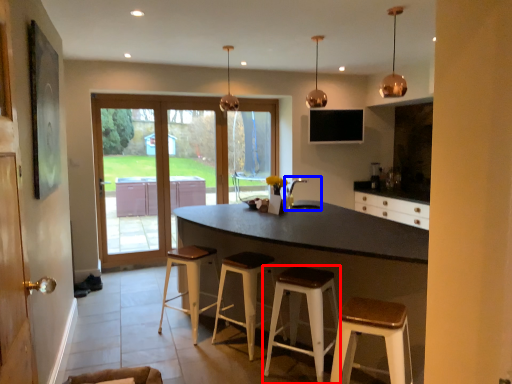
Question: Among these objects, which one is nearest to the camera, stool (highlighted by a red box) or sink (highlighted by a blue box)?

Choices:
 (A) stool
 (B) sink

Answer: (A)